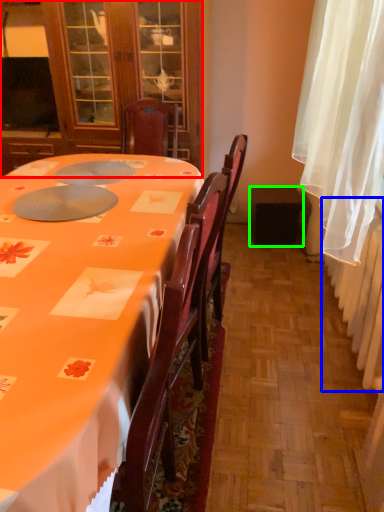
Question: Considering the real-world distances, which object is closest to cabinetry (highlighted by a red box)? radiator (highlighted by a blue box) or loudspeaker (highlighted by a green box).

Choices:
 (A) radiator
 (B) loudspeaker

Answer: (B)